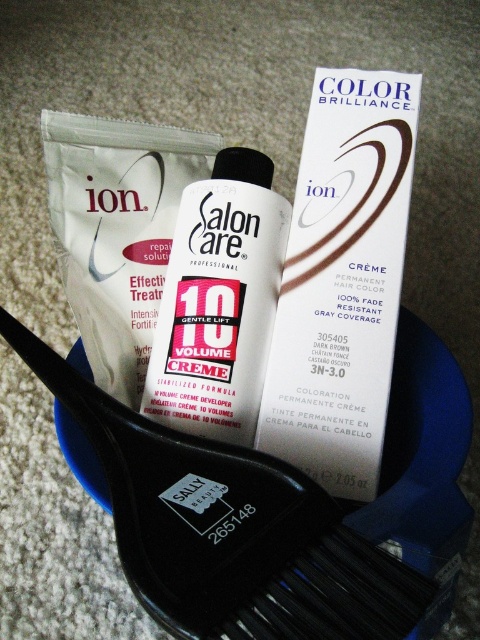
You are a photographer adjusting your camera to focus on two points in the scene. One point is at coordinate point(400, 192) and the other at point(180, 408). Which point should you focus on first if you want to capture the closest object to the camera?

Point(400, 192) is further to the camera than point(180, 408). Therefore, if you want to capture the closest object to the camera, you should focus on point(180, 408) first.

You are organizing hair care products on a shelf and need to place the dark brown cream at upper right and the white glossy bottle at center. If the shelf space is exactly the same width as the wider of the two items, which item should you measure to determine the minimum width required?

You should measure the dark brown cream at upper right because the dark brown cream at upper right might be wider than the white glossy bottle at center according to the description.

You are a customer at a beauty supply store and you see the black plastic brush at center. Can you determine its exact location in the image?

The black plastic brush at center is located at point 0.828 on the x axis and 0.477 on the y axis.